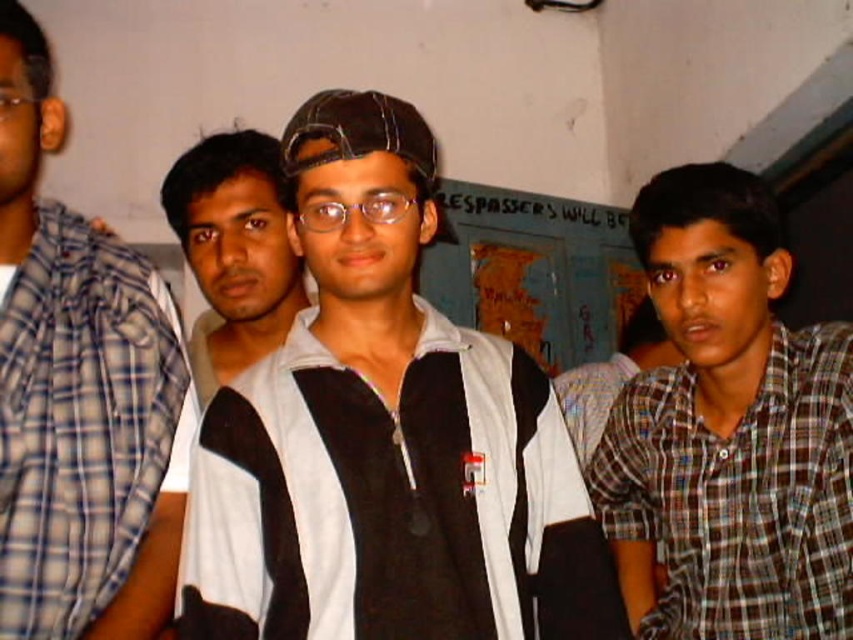
Question: Is brown checkered shirt at right in front of white cotton shirt at left?

Choices:
 (A) no
 (B) yes

Answer: (A)

Question: Among these objects, which one is nearest to the camera?

Choices:
 (A) brown checkered shirt at right
 (B) black and white striped shirt at center
 (C) black matte jacket at center

Answer: (C)

Question: Is brown checkered shirt at right bigger than white cotton shirt at left?

Choices:
 (A) no
 (B) yes

Answer: (B)

Question: From the image, what is the correct spatial relationship of white cotton shirt at left in relation to black and white striped shirt at center?

Choices:
 (A) right
 (B) left

Answer: (B)

Question: Which object is closer to the camera taking this photo?

Choices:
 (A) brown checkered shirt at right
 (B) black and white striped shirt at center

Answer: (A)

Question: Estimate the real-world distances between objects in this image. Which object is farther from the white cotton shirt at left?

Choices:
 (A) brown checkered shirt at right
 (B) black matte jacket at center
 (C) black and white striped shirt at center

Answer: (A)